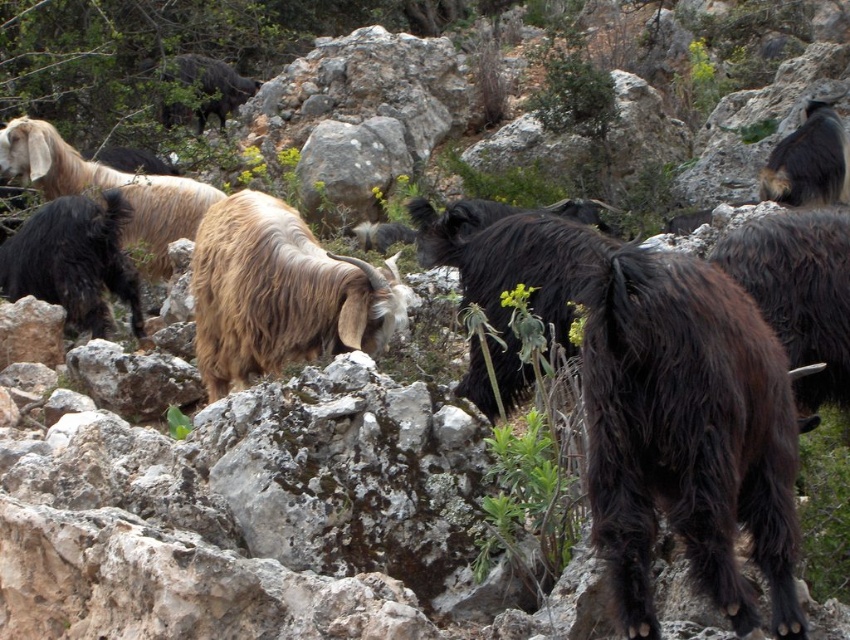
You are standing in the rocky landscape and want to determine which of the two points, point (37, 160) or point (805, 125), is closer to you. Based on the scene description, which point is nearer?

Point (37, 160) is closer to the viewer than point (805, 125).

You are a hiker trying to locate two dark brown woolen rams in the rocky landscape. According to the scene, which ram is closer to you, the dark brown woolen ram at upper right or the dark brown woolen ram at upper center?

The dark brown woolen ram at upper right is closer to you because it is in front of the dark brown woolen ram at upper center.

Looking at this image, you are a hiker trying to navigate the rocky terrain and need to pass between the dark brown woolen ram at right and the dark brown woolen ram at upper right. Based on their positions, which direction should you move to go between them?

You should move towards the lower area between the dark brown woolen ram at right and the dark brown woolen ram at upper right since the dark brown woolen ram at right is located below the other ram.